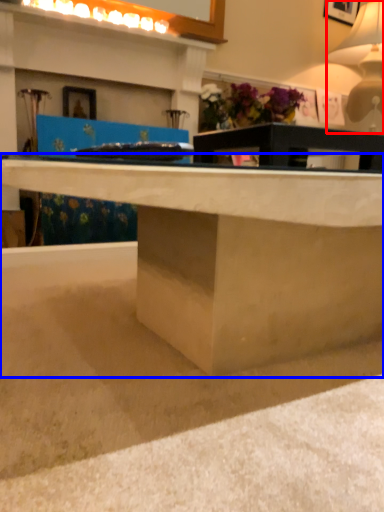
Question: Which of the following is the farthest to the observer, table lamp (highlighted by a red box) or desk (highlighted by a blue box)?

Choices:
 (A) table lamp
 (B) desk

Answer: (A)